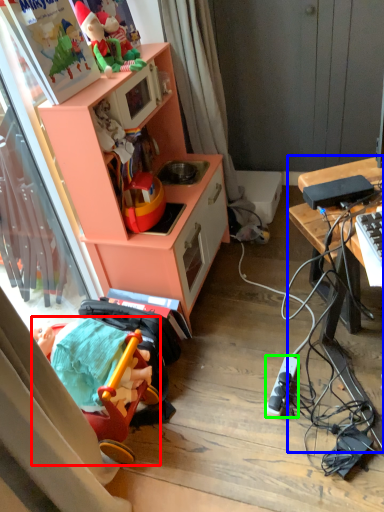
Question: Which is nearer to the toy (highlighted by a red box)? desk (highlighted by a blue box) or appliance (highlighted by a green box).

Choices:
 (A) desk
 (B) appliance

Answer: (B)